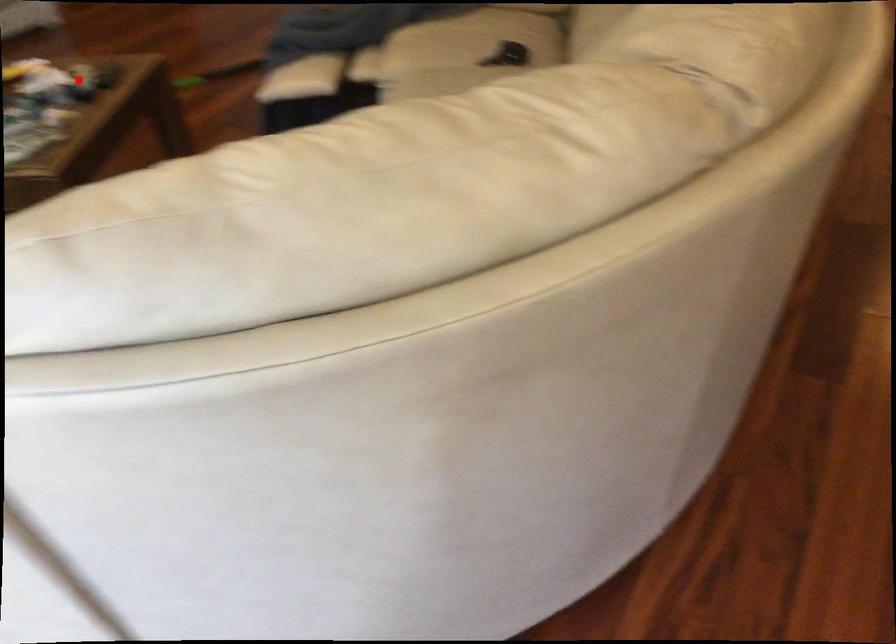
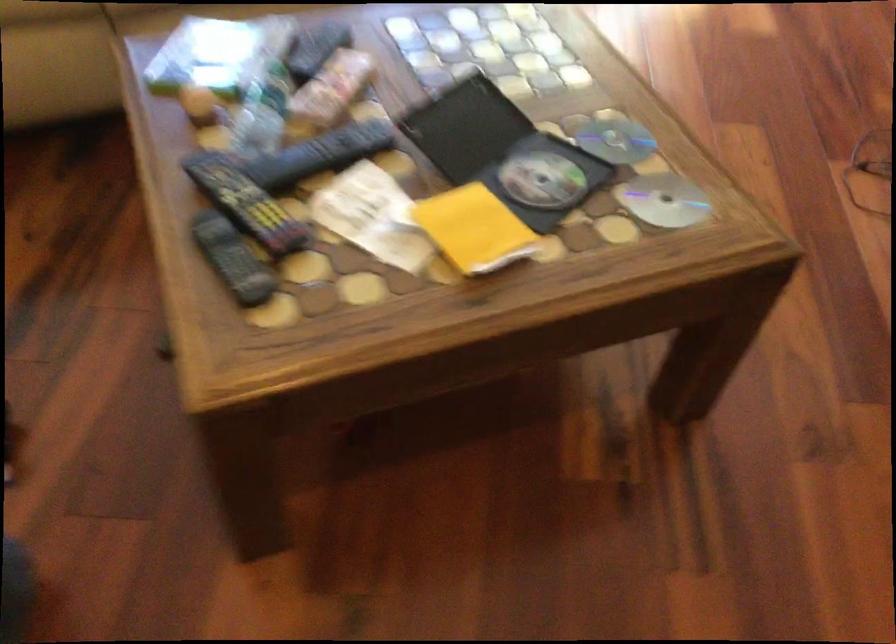
Find the pixel in the second image that matches the highlighted location in the first image.

(245, 202)